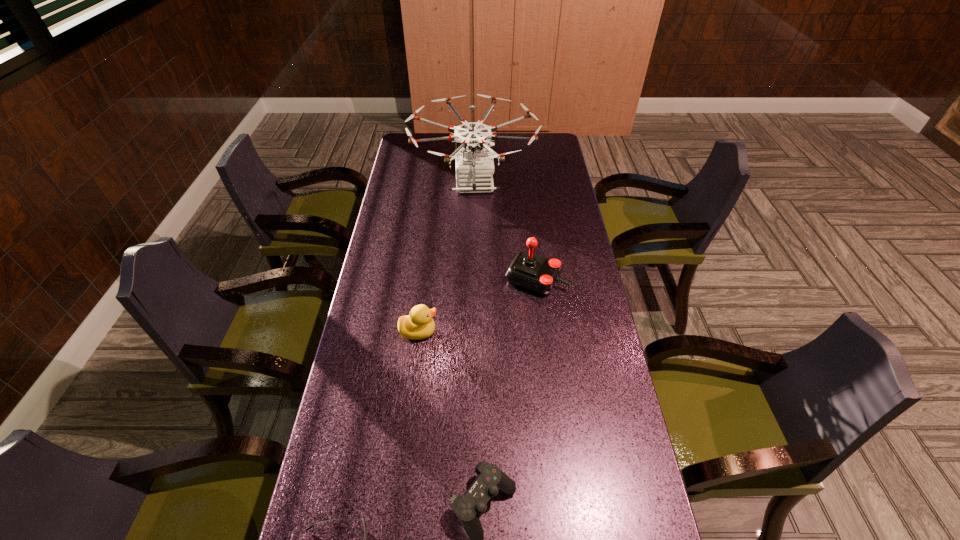
Locate which object is the closest to the second tallest object. Please provide its 2D coordinates. Your answer should be formatted as a tuple, i.e. [(x, y)], where the tuple contains the x and y coordinates of a point satisfying the conditions above.

[(474, 167)]

At what (x,y) coordinates should I click in order to perform the action: click on the third closest object to the joystick. Please return your answer as a coordinate pair (x, y). The image size is (960, 540). Looking at the image, I should click on (490, 480).